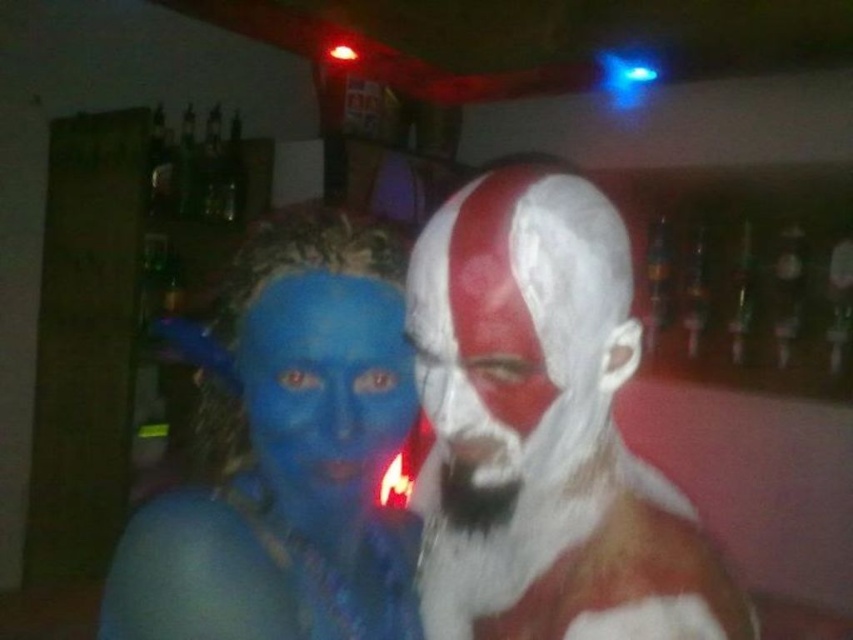
Question: Considering the relative positions of matte blue face paint at center and white matte beard at center in the image provided, where is matte blue face paint at center located with respect to white matte beard at center?

Choices:
 (A) left
 (B) right

Answer: (A)

Question: Does white matte face paint at center appear on the right side of blue matte face paint at center?

Choices:
 (A) yes
 (B) no

Answer: (A)

Question: Among these points, which one is farthest from the camera?

Choices:
 (A) (573, 602)
 (B) (415, 468)

Answer: (B)

Question: Does matte blue face paint at center appear on the right side of blue matte face paint at center?

Choices:
 (A) no
 (B) yes

Answer: (A)

Question: Which point appears closest to the camera in this image?

Choices:
 (A) (329, 520)
 (B) (270, 458)
 (C) (602, 282)

Answer: (C)

Question: Which point is closer to the camera?

Choices:
 (A) white matte beard at center
 (B) matte blue face paint at center
 (C) blue matte face paint at center

Answer: (B)